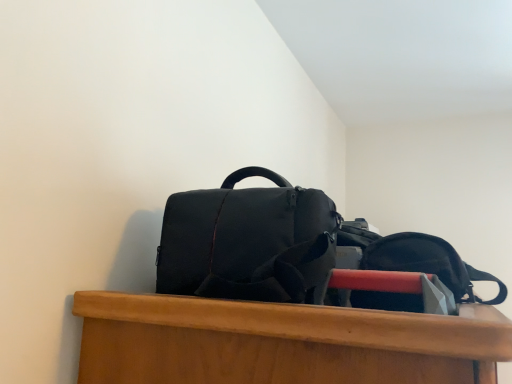
Question: Can you confirm if matte black duffel bag at upper center, marked as the 2th backpack in a right-to-left arrangement, is bigger than matte black backpack at upper center, the 1th backpack positioned from the right?

Choices:
 (A) yes
 (B) no

Answer: (A)

Question: Is matte black duffel bag at upper center, marked as the 2th backpack in a right-to-left arrangement, positioned before matte black backpack at upper center, the 1th backpack positioned from the right?

Choices:
 (A) no
 (B) yes

Answer: (B)

Question: Considering the relative positions of matte black duffel bag at upper center, the 1th backpack in the left-to-right sequence, and matte black backpack at upper center, marked as the second backpack in a left-to-right arrangement, in the image provided, is matte black duffel bag at upper center, the 1th backpack in the left-to-right sequence, to the right of matte black backpack at upper center, marked as the second backpack in a left-to-right arrangement, from the viewer's perspective?

Choices:
 (A) no
 (B) yes

Answer: (A)

Question: From a real-world perspective, does matte black duffel bag at upper center, the 1th backpack in the left-to-right sequence, sit lower than matte black backpack at upper center, marked as the second backpack in a left-to-right arrangement?

Choices:
 (A) no
 (B) yes

Answer: (A)

Question: Would you say matte black duffel bag at upper center, the 1th backpack in the left-to-right sequence, is a long distance from matte black backpack at upper center, the 1th backpack positioned from the right?

Choices:
 (A) no
 (B) yes

Answer: (A)

Question: From a real-world perspective, is matte black duffel bag at upper center, the 1th backpack in the left-to-right sequence, on top of matte black backpack at upper center, the 1th backpack positioned from the right?

Choices:
 (A) yes
 (B) no

Answer: (A)

Question: Would you consider matte black backpack at upper center, the 1th backpack positioned from the right, to be distant from matte black duffel bag at upper center, the 1th backpack in the left-to-right sequence?

Choices:
 (A) no
 (B) yes

Answer: (A)

Question: Is matte black duffel bag at upper center, the 1th backpack in the left-to-right sequence, completely or partially inside matte black backpack at upper center, the 1th backpack positioned from the right?

Choices:
 (A) yes
 (B) no

Answer: (B)

Question: Is matte black backpack at upper center, marked as the second backpack in a left-to-right arrangement, to the left of matte black duffel bag at upper center, the 1th backpack in the left-to-right sequence, from the viewer's perspective?

Choices:
 (A) no
 (B) yes

Answer: (A)

Question: Does matte black backpack at upper center, marked as the second backpack in a left-to-right arrangement, have a larger size compared to matte black duffel bag at upper center, marked as the 2th backpack in a right-to-left arrangement?

Choices:
 (A) yes
 (B) no

Answer: (B)

Question: Is matte black backpack at upper center, the 1th backpack positioned from the right, oriented towards matte black duffel bag at upper center, the 1th backpack in the left-to-right sequence?

Choices:
 (A) yes
 (B) no

Answer: (B)

Question: From the image's perspective, does matte black backpack at upper center, the 1th backpack positioned from the right, appear higher than matte black duffel bag at upper center, the 1th backpack in the left-to-right sequence?

Choices:
 (A) yes
 (B) no

Answer: (B)

Question: From their relative heights in the image, would you say matte black backpack at upper center, marked as the second backpack in a left-to-right arrangement, is taller or shorter than matte black duffel bag at upper center, the 1th backpack in the left-to-right sequence?

Choices:
 (A) short
 (B) tall

Answer: (A)